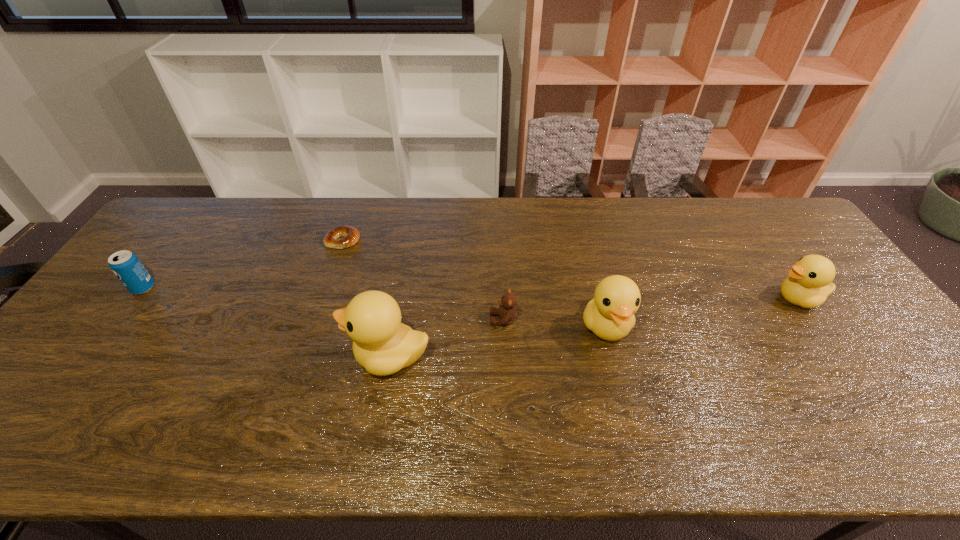
The width and height of the screenshot is (960, 540). In order to click on free space located on the face of the fourth object from left to right in this screenshot , I will do `click(453, 320)`.

The image size is (960, 540). I want to click on free spot located on the face of the fourth object from left to right, so click(x=438, y=320).

Find the location of `vacant space located on the face of the fourth object from left to right`. vacant space located on the face of the fourth object from left to right is located at coordinates (x=409, y=320).

In order to click on object at the far edge in this screenshot , I will do 340,237.

Locate an element on the screen. This screenshot has height=540, width=960. object present at the near edge is located at coordinates (383, 345).

The height and width of the screenshot is (540, 960). I want to click on object that is at the left edge, so click(x=127, y=267).

You are a GUI agent. You are given a task and a screenshot of the screen. Output one action in this format:
    pyautogui.click(x=<x>, y=<y>)
    Task: Click on the object present at the right edge
    The height and width of the screenshot is (540, 960).
    Given the screenshot: What is the action you would take?
    pyautogui.click(x=809, y=283)

Find the location of a particular element. blank area at the far edge is located at coordinates (412, 211).

At what (x,y) coordinates should I click in order to perform the action: click on free space at the near edge of the desktop. Please return your answer as a coordinate pair (x, y). Looking at the image, I should click on (222, 400).

Image resolution: width=960 pixels, height=540 pixels. In the image, there is a desktop. Identify the location of vacant space at the left edge. (185, 264).